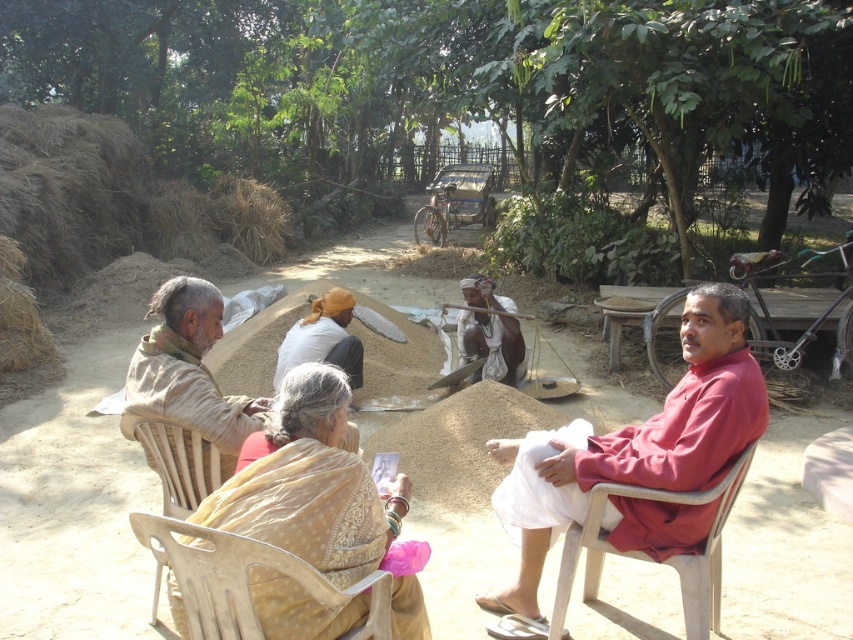
Is beige fabric headscarf at left below light beige fabric at center?

Correct, beige fabric headscarf at left is located below light beige fabric at center.

Does beige fabric headscarf at left appear on the right side of light beige fabric at center?

In fact, beige fabric headscarf at left is to the left of light beige fabric at center.

Is point (183, 394) in front of point (323, 307)?

That is True.

In order to click on beige fabric headscarf at left in this screenshot , I will do `click(189, 371)`.

Between point (309, 422) and point (204, 372), which one is positioned in front?

Positioned in front is point (309, 422).

Who is shorter, beige fabric shawl at center or beige fabric headscarf at left?

beige fabric headscarf at left is shorter.

What are the coordinates of `beige fabric shawl at center` in the screenshot? It's located at (321, 497).

The width and height of the screenshot is (853, 640). Identify the location of beige fabric shawl at center. (321, 497).

Between brown dirt field at center and white cotton cloth at center, which one has more height?

With more height is brown dirt field at center.

Is brown dirt field at center above white cotton cloth at center?

Yes.

The width and height of the screenshot is (853, 640). Identify the location of brown dirt field at center. pyautogui.click(x=74, y=508).